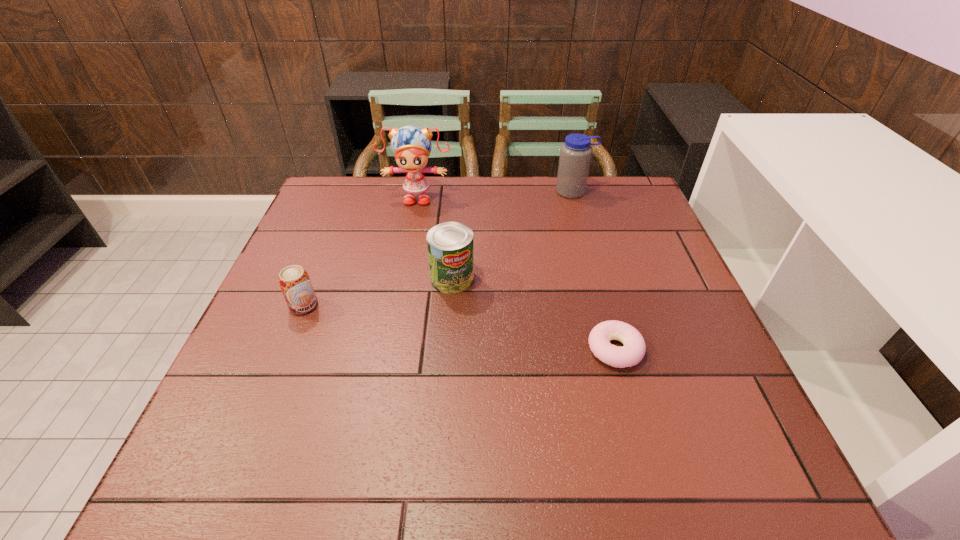
At what (x,y) coordinates should I click in order to perform the action: click on the tallest object. Please return your answer as a coordinate pair (x, y). The height and width of the screenshot is (540, 960). Looking at the image, I should click on (411, 145).

In order to click on the fourth shortest object in this screenshot , I will do `click(575, 154)`.

Locate an element on the screen. can is located at coordinates (450, 247).

You are a GUI agent. You are given a task and a screenshot of the screen. Output one action in this format:
    pyautogui.click(x=<x>, y=<y>)
    Task: Click on the third shortest object
    
    Given the screenshot: What is the action you would take?
    pyautogui.click(x=450, y=247)

This screenshot has width=960, height=540. In order to click on beer can in this screenshot , I will do `click(294, 281)`.

At what (x,y) coordinates should I click in order to perform the action: click on the second shortest object. Please return your answer as a coordinate pair (x, y). Looking at the image, I should click on (294, 281).

In order to click on the shortest object in this screenshot , I will do `click(633, 351)`.

In order to click on doughnut in this screenshot , I will do `click(633, 351)`.

In order to click on free point located on the face of the doll in this screenshot , I will do `click(411, 228)`.

Identify the location of vacant space positioned with a carrying loop on the side of the second tallest object. (594, 263).